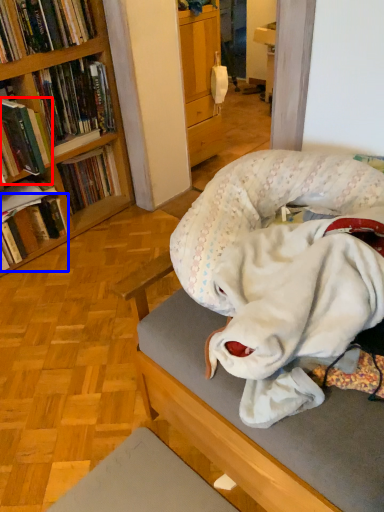
Question: Which of the following is the farthest to the observer, book (highlighted by a red box) or book (highlighted by a blue box)?

Choices:
 (A) book
 (B) book

Answer: (B)